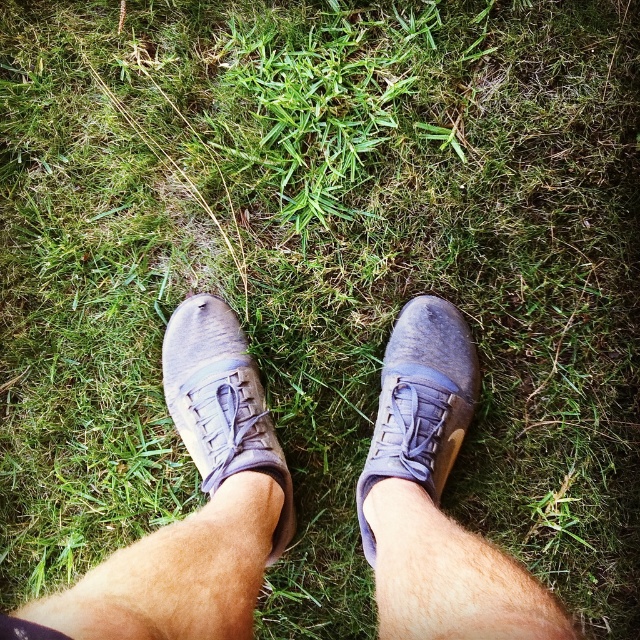
Question: Which is farther from the matte leather shoe at center?

Choices:
 (A) matte gray shoe at center
 (B) leather shoes at center

Answer: (A)

Question: Is leather shoes at center closer to the viewer compared to matte leather shoe at center?

Choices:
 (A) no
 (B) yes

Answer: (B)

Question: Is leather shoes at center bigger than matte gray shoe at center?

Choices:
 (A) no
 (B) yes

Answer: (B)

Question: Which object is the farthest from the matte leather shoe at center?

Choices:
 (A) matte gray shoe at center
 (B) leather shoes at center

Answer: (A)

Question: Among these objects, which one is nearest to the camera?

Choices:
 (A) matte gray shoe at center
 (B) leather shoes at center
 (C) matte leather shoe at center

Answer: (B)

Question: Does leather shoes at center lie behind matte leather shoe at center?

Choices:
 (A) yes
 (B) no

Answer: (B)